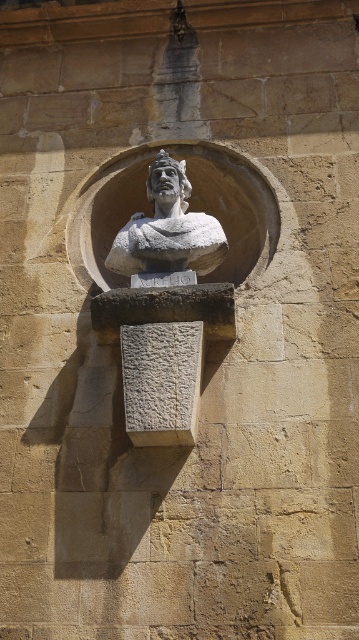
Who is more forward, (176, 236) or (184, 161)?

Point (176, 236)

Who is shorter, white stone bust at center or matte stone bust at center?

matte stone bust at center is shorter.

Is point (194, 227) more distant than point (160, 156)?

No, it is in front of (160, 156).

Where is `white stone bust at center`? The image size is (359, 640). white stone bust at center is located at coordinates (168, 228).